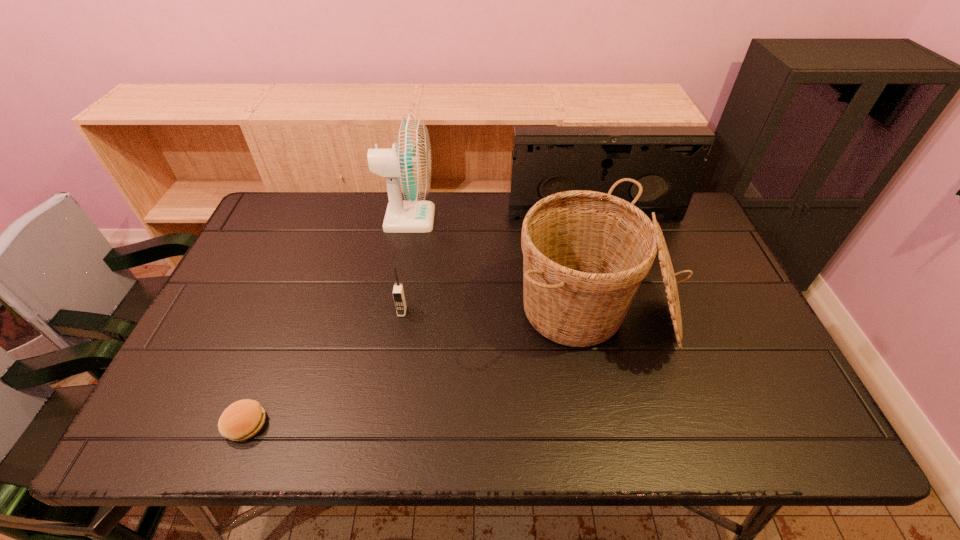
At what (x,y) coordinates should I click in order to perform the action: click on vacant area between the cellular telephone and the videotape. Please return your answer as a coordinate pair (x, y). Looking at the image, I should click on [498, 264].

What are the coordinates of `vacant space that is in between the fourth tallest object and the videotape` in the screenshot? It's located at (498, 264).

Locate which object is the third closest to the basket. Please provide its 2D coordinates. Your answer should be formatted as a tuple, i.e. [(x, y)], where the tuple contains the x and y coordinates of a point satisfying the conditions above.

[(398, 293)]

Locate which object ranks second in proximity to the patty. Please provide its 2D coordinates. Your answer should be formatted as a tuple, i.e. [(x, y)], where the tuple contains the x and y coordinates of a point satisfying the conditions above.

[(407, 168)]

Locate an element on the screen. This screenshot has height=540, width=960. blank area in the image that satisfies the following two spatial constraints: 1. on the back side of the nearest object; 2. on the right side of the basket is located at coordinates (289, 312).

The height and width of the screenshot is (540, 960). Find the location of `vacant space that satisfies the following two spatial constraints: 1. on the front-facing side of the fourth tallest object; 2. on the right side of the basket`. vacant space that satisfies the following two spatial constraints: 1. on the front-facing side of the fourth tallest object; 2. on the right side of the basket is located at coordinates (402, 312).

Locate an element on the screen. This screenshot has height=540, width=960. free location that satisfies the following two spatial constraints: 1. on the front side of the videotape; 2. in front of the fan to face the airflow is located at coordinates (594, 219).

Locate an element on the screen. vacant region that satisfies the following two spatial constraints: 1. on the front side of the videotape; 2. in front of the fan to face the airflow is located at coordinates (594, 219).

Where is `free space that satisfies the following two spatial constraints: 1. on the front side of the videotape; 2. in front of the fan to face the airflow`? The image size is (960, 540). free space that satisfies the following two spatial constraints: 1. on the front side of the videotape; 2. in front of the fan to face the airflow is located at coordinates (594, 219).

What are the coordinates of `free space that satisfies the following two spatial constraints: 1. on the front side of the videotape; 2. in front of the fan to face the airflow` in the screenshot? It's located at (594, 219).